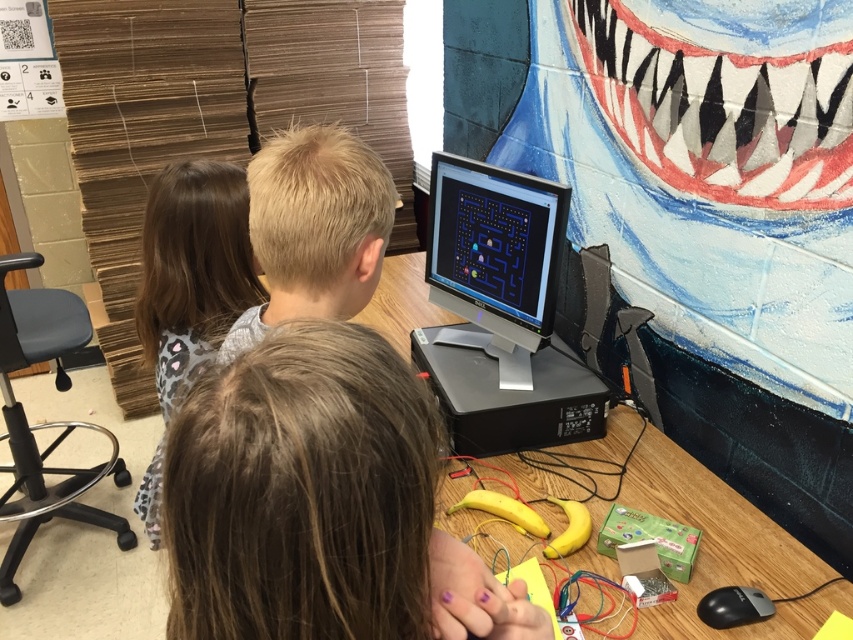
Between blonde hair at center and matte black monitor at center, which one appears on the right side from the viewer's perspective?

matte black monitor at center

Does blonde hair at center appear over matte black monitor at center?

Actually, blonde hair at center is below matte black monitor at center.

Where is `blonde hair at center`? The height and width of the screenshot is (640, 853). blonde hair at center is located at coordinates (314, 228).

What are the coordinates of `blonde hair at center` in the screenshot? It's located at (314, 228).

Does blonde hair at center appear on the left side of brown leopard print dress at upper left?

No, blonde hair at center is not to the left of brown leopard print dress at upper left.

Is blonde hair at center wider than brown leopard print dress at upper left?

In fact, blonde hair at center might be narrower than brown leopard print dress at upper left.

At what (x,y) coordinates should I click in order to perform the action: click on blonde hair at center. Please return your answer as a coordinate pair (x, y). This screenshot has height=640, width=853. Looking at the image, I should click on (314, 228).

Identify the location of blonde hair at center. This screenshot has width=853, height=640. (314, 228).

Does brown hair at center have a lesser width compared to wooden table at center?

Correct, brown hair at center's width is less than wooden table at center's.

Locate an element on the screen. The image size is (853, 640). brown hair at center is located at coordinates [320, 502].